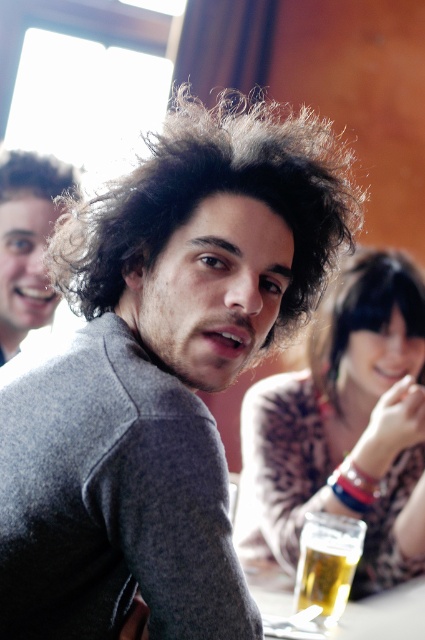
Question: Which of the following is the farthest from the observer?

Choices:
 (A) fur-like sweater at center
 (B) curly brown hair at center
 (C) matte black hair at upper left
 (D) black shiny hair at lower right

Answer: (C)

Question: Which point is farther from the camera taking this photo?

Choices:
 (A) (314, 547)
 (B) (367, 481)

Answer: (B)

Question: Is matte black hair at upper left below black shiny hair at lower right?

Choices:
 (A) no
 (B) yes

Answer: (A)

Question: Which point appears closest to the camera in this image?

Choices:
 (A) (336, 145)
 (B) (34, 188)
 (C) (308, 576)
 (D) (354, 282)

Answer: (C)

Question: Does curly brown hair at center lie behind matte black hair at upper left?

Choices:
 (A) no
 (B) yes

Answer: (A)

Question: Does curly brown hair at center appear under translucent glass beer at lower center?

Choices:
 (A) no
 (B) yes

Answer: (A)